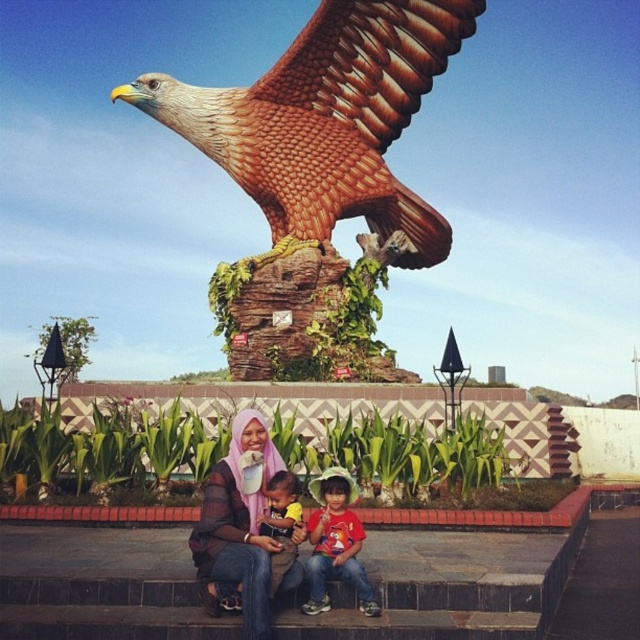
Question: Is brown glossy eagle at upper center further to the viewer compared to soft yellow fabric shirt at center?

Choices:
 (A) no
 (B) yes

Answer: (B)

Question: Does red cotton shirt at center have a smaller size compared to soft yellow fabric shirt at center?

Choices:
 (A) no
 (B) yes

Answer: (B)

Question: Which point appears closest to the camera in this image?

Choices:
 (A) (273, 564)
 (B) (268, 580)

Answer: (B)

Question: Estimate the real-world distances between objects in this image. Which object is closer to the brown glossy eagle at upper center?

Choices:
 (A) pink sheer hijab at center
 (B) soft yellow fabric shirt at center
 (C) red cotton shirt at center

Answer: (A)

Question: Can you confirm if pink sheer hijab at center is positioned to the right of red cotton shirt at center?

Choices:
 (A) no
 (B) yes

Answer: (A)

Question: Which object appears farthest from the camera in this image?

Choices:
 (A) pink sheer hijab at center
 (B) soft yellow fabric shirt at center

Answer: (B)